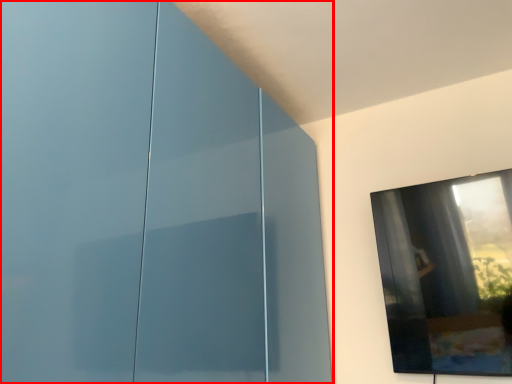
Question: From the image's perspective, considering the relative positions of glass door (annotated by the red box) and window in the image provided, where is glass door (annotated by the red box) located with respect to the staircase?

Choices:
 (A) below
 (B) above

Answer: (B)